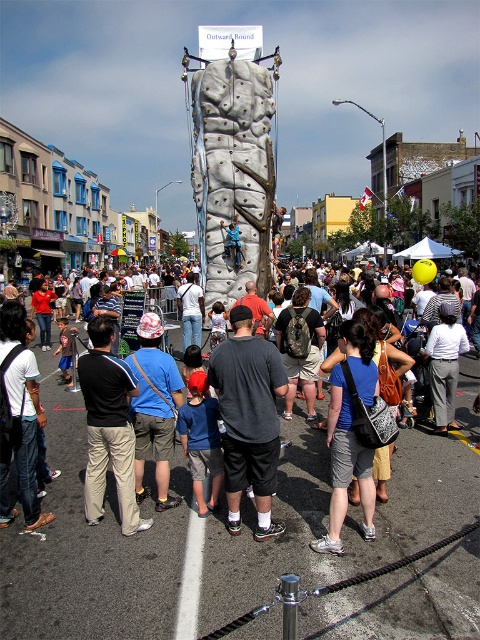
You are a photographer trying to capture a photo of the white textured climbing wall at center and the denim shorts at center in the same frame. Given their sizes, which object should you focus on first to ensure both are clearly visible in your shot?

The white textured climbing wall at center is larger than the denim shorts at center, so you should focus on the white textured climbing wall at center first to ensure both are clearly visible in the shot.

Looking at this image, you are standing at the center of the image. Where is the white textured climbing wall at center located relative to your position?

The white textured climbing wall at center is located at point [232,170] relative to your position.